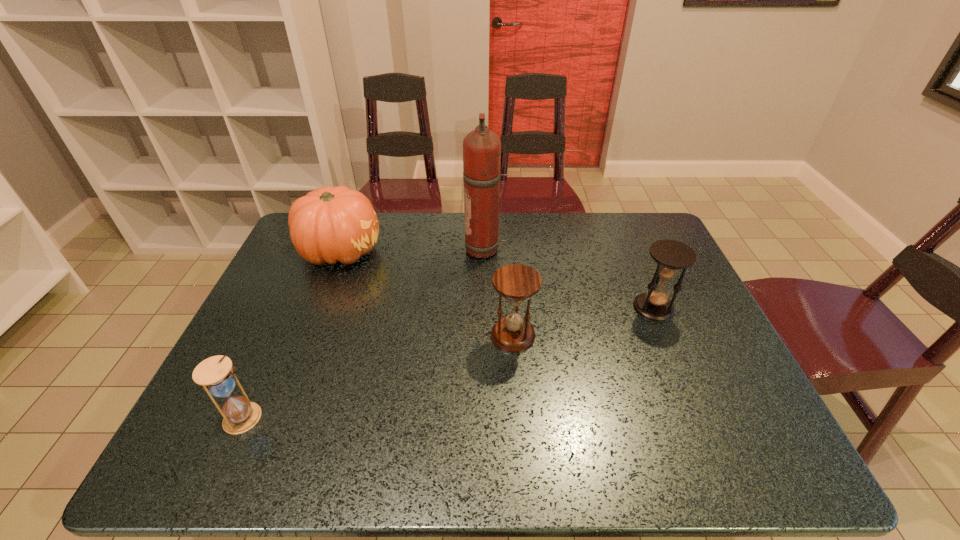
At what (x,y) coordinates should I click in order to perform the action: click on free space located 0.080m on the right of the rightmost object. Please return your answer as a coordinate pair (x, y). The width and height of the screenshot is (960, 540). Looking at the image, I should click on (703, 308).

Where is `vacant space situated on the back of the second hourglass from left to right`? This screenshot has width=960, height=540. vacant space situated on the back of the second hourglass from left to right is located at coordinates (508, 265).

At what (x,y) coordinates should I click in order to perform the action: click on vacant region located on the back of the leftmost hourglass. Please return your answer as a coordinate pair (x, y). Looking at the image, I should click on (301, 293).

Find the location of `fire extinguisher located in the far edge section of the desktop`. fire extinguisher located in the far edge section of the desktop is located at coordinates (481, 147).

Identify the location of pumpkin present at the far edge. (330, 224).

Find the location of `object that is at the near edge`. object that is at the near edge is located at coordinates (215, 374).

You are a GUI agent. You are given a task and a screenshot of the screen. Output one action in this format:
    pyautogui.click(x=<x>, y=<y>)
    Task: Click on the pumpkin present at the left edge
    The width and height of the screenshot is (960, 540).
    Given the screenshot: What is the action you would take?
    pyautogui.click(x=330, y=224)

You are a GUI agent. You are given a task and a screenshot of the screen. Output one action in this format:
    pyautogui.click(x=<x>, y=<y>)
    Task: Click on the hourglass located in the left edge section of the desktop
    The width and height of the screenshot is (960, 540).
    Given the screenshot: What is the action you would take?
    pyautogui.click(x=215, y=374)

You are a GUI agent. You are given a task and a screenshot of the screen. Output one action in this format:
    pyautogui.click(x=<x>, y=<y>)
    Task: Click on the object at the right edge
    The image size is (960, 540).
    Given the screenshot: What is the action you would take?
    pyautogui.click(x=671, y=256)

At what (x,y) coordinates should I click in order to perform the action: click on object situated at the far left corner. Please return your answer as a coordinate pair (x, y). This screenshot has height=540, width=960. Looking at the image, I should click on (330, 224).